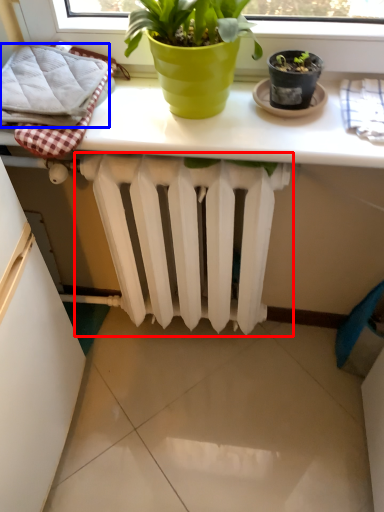
Question: Which object is further to the camera taking this photo, radiator (highlighted by a red box) or bath towel (highlighted by a blue box)?

Choices:
 (A) radiator
 (B) bath towel

Answer: (A)